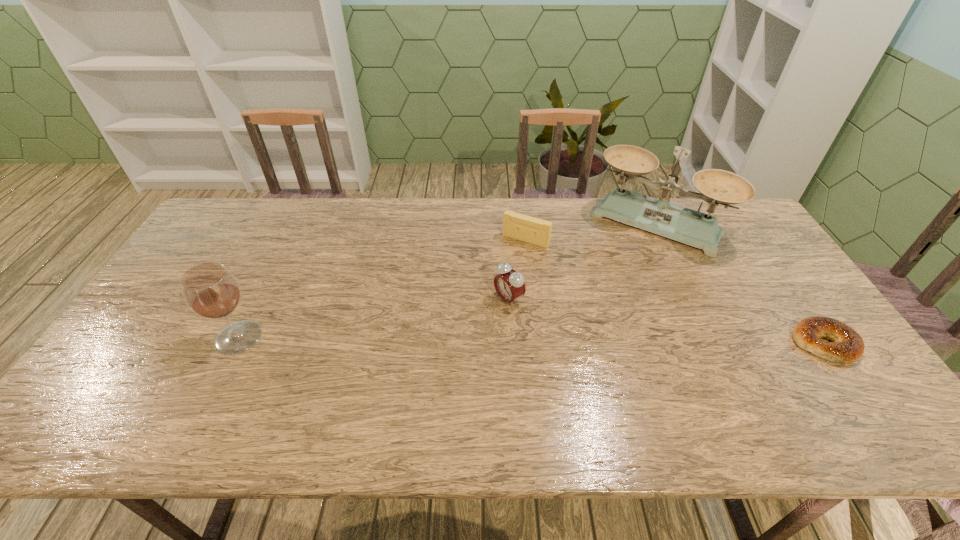
I want to click on vacant point located 0.170m at the front of the videotape with spools, so click(x=495, y=281).

The height and width of the screenshot is (540, 960). What are the coordinates of `free space located at the front of the videotape with spools` in the screenshot? It's located at (489, 292).

Where is `free space located on the front-facing side of the tallest object`? free space located on the front-facing side of the tallest object is located at coordinates (628, 261).

Locate an element on the screen. The image size is (960, 540). free point located 0.260m on the front-facing side of the tallest object is located at coordinates (603, 303).

Find the location of a particular element. free location located 0.150m on the front-facing side of the tallest object is located at coordinates (616, 280).

At what (x,y) coordinates should I click in order to perform the action: click on vacant area located on the clock face of the alarm clock. Please return your answer as a coordinate pair (x, y). The image size is (960, 540). Looking at the image, I should click on (419, 355).

Find the location of `free space located 0.320m on the clock face of the alarm clock`. free space located 0.320m on the clock face of the alarm clock is located at coordinates (398, 367).

Identify the location of vacant space located on the clock face of the alarm clock. (444, 339).

Where is `videotape located in the far edge section of the desktop`? The image size is (960, 540). videotape located in the far edge section of the desktop is located at coordinates click(x=536, y=231).

Locate an element on the screen. The height and width of the screenshot is (540, 960). scale at the far edge is located at coordinates (659, 216).